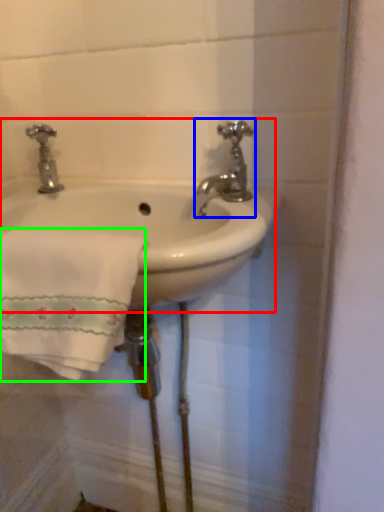
Question: Which is farther away from sink (highlighted by a red box)? tap (highlighted by a blue box) or bath towel (highlighted by a green box)?

Choices:
 (A) tap
 (B) bath towel

Answer: (B)